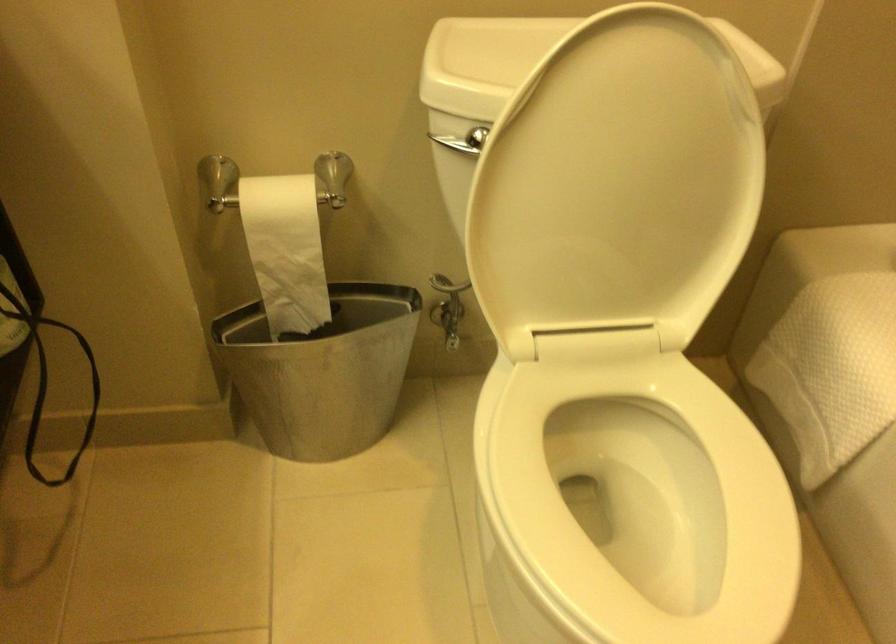
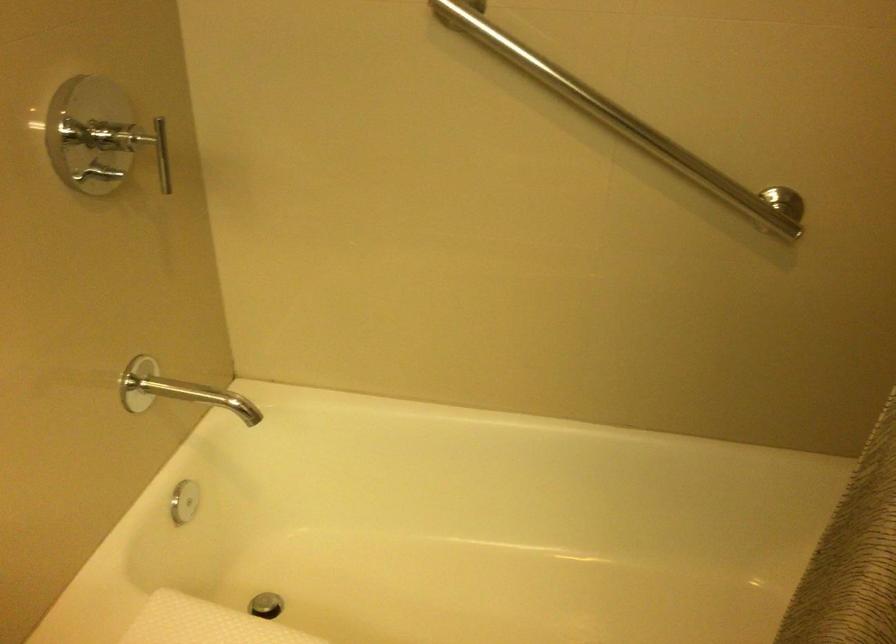
Question: The camera is either moving clockwise (left) or counter-clockwise (right) around the object. The first image is from the beginning of the video and the second image is from the end. Is the camera moving left or right when shooting the video?

Choices:
 (A) Left
 (B) Right

Answer: (A)